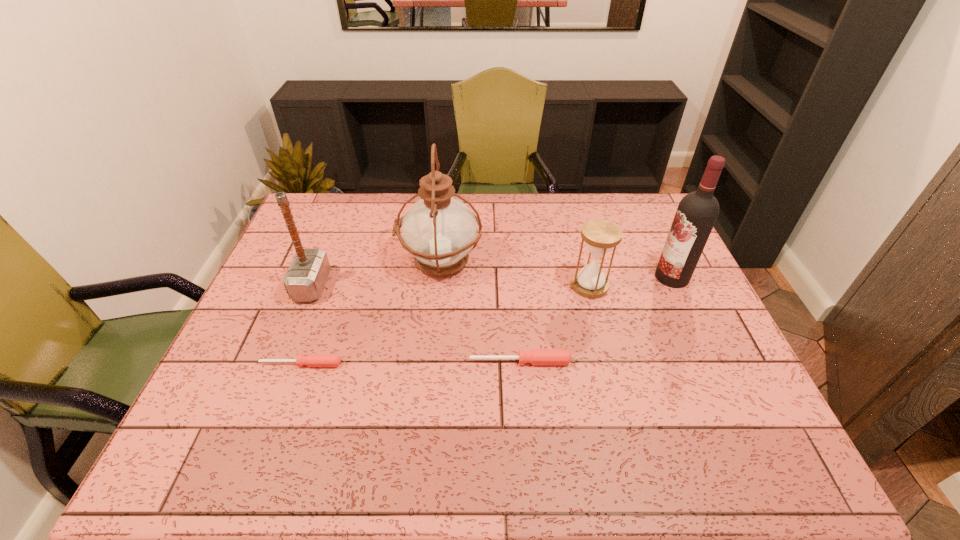
The image size is (960, 540). Find the location of `free space that satisfies the following two spatial constraints: 1. on the front side of the oil lamp; 2. on the right side of the hourglass`. free space that satisfies the following two spatial constraints: 1. on the front side of the oil lamp; 2. on the right side of the hourglass is located at coordinates (438, 286).

Identify the location of vacant point that satisfies the following two spatial constraints: 1. on the striking surface of the fifth tallest object; 2. on the left side of the hammer. Image resolution: width=960 pixels, height=540 pixels. (281, 362).

Identify the location of vacant space that satisfies the following two spatial constraints: 1. on the label of the rightmost object; 2. on the front side of the shorter screwdriver. (712, 364).

I want to click on vacant region that satisfies the following two spatial constraints: 1. on the back side of the taller screwdriver; 2. on the left side of the third shortest object, so click(x=515, y=286).